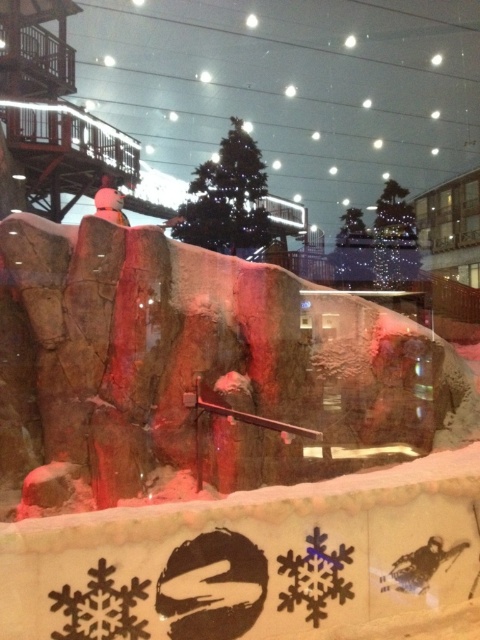
You are standing at the entrance of the indoor ski slope and see the black paper snowflake at lower center. If you walk straight ahead, will you reach the snowflake before the artificial rock formation?

The black paper snowflake at lower center is located at point (314, 577). Since coordinates closer to 1 on the x and y axes are further away from the entrance, the snowflake is positioned farther back. The artificial rock formation is in the foreground, so walking straight ahead would reach the rock formation before the snowflake.

You are standing at the bottom of the indoor ski slope and want to take a photo of both the black paper snowflake at lower center and the white matte snowboarder at center. Which object should you focus on first to ensure both are in clear view?

You should focus on the black paper snowflake at lower center first because it is closer to the viewer than the white matte snowboarder at center, so adjusting focus from near to far will help capture both clearly.